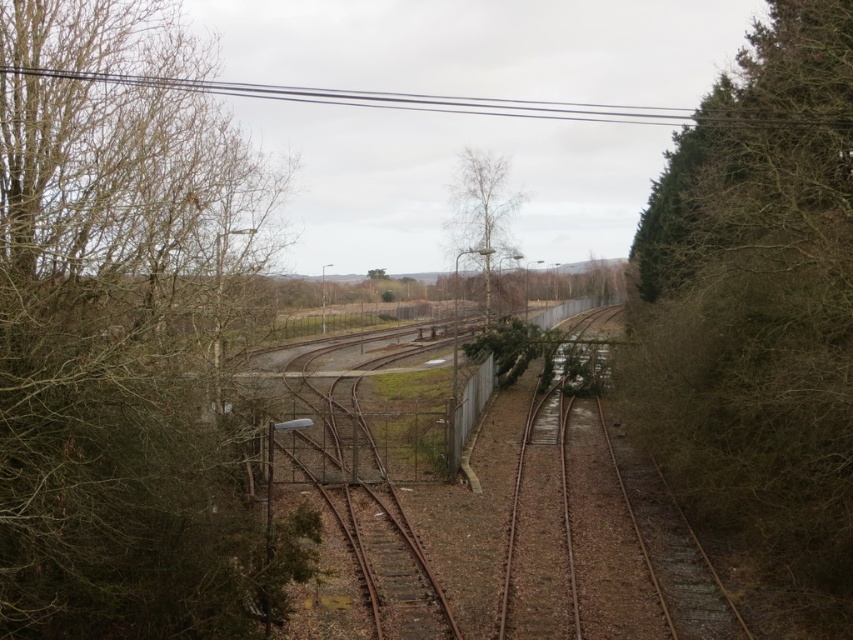
Does point (160, 346) come closer to viewer compared to point (686, 140)?

Yes, it is in front of point (686, 140).

Is brown leafless tree at left shorter than green leafy tree at right?

Yes, brown leafless tree at left is shorter than green leafy tree at right.

This screenshot has width=853, height=640. In order to click on brown leafless tree at left in this screenshot , I will do `click(128, 337)`.

Based on the photo, which is more to the left, brown leafless tree at left or bare wood tree at center?

brown leafless tree at left

Who is positioned more to the right, brown leafless tree at left or bare wood tree at center?

bare wood tree at center is more to the right.

You are a GUI agent. You are given a task and a screenshot of the screen. Output one action in this format:
    pyautogui.click(x=<x>, y=<y>)
    Task: Click on the brown leafless tree at left
    The height and width of the screenshot is (640, 853).
    Given the screenshot: What is the action you would take?
    pyautogui.click(x=128, y=337)

At what (x,y) coordinates should I click in order to perform the action: click on brown leafless tree at left. Please return your answer as a coordinate pair (x, y). The height and width of the screenshot is (640, 853). Looking at the image, I should click on (128, 337).

Can you confirm if green leafy tree at right is thinner than bare wood tree at center?

Indeed, green leafy tree at right has a lesser width compared to bare wood tree at center.

Does point (811, 186) come in front of point (505, 225)?

Yes, it is.

At what (x,y) coordinates should I click in order to perform the action: click on green leafy tree at right. Please return your answer as a coordinate pair (x, y). This screenshot has height=640, width=853. Looking at the image, I should click on (758, 305).